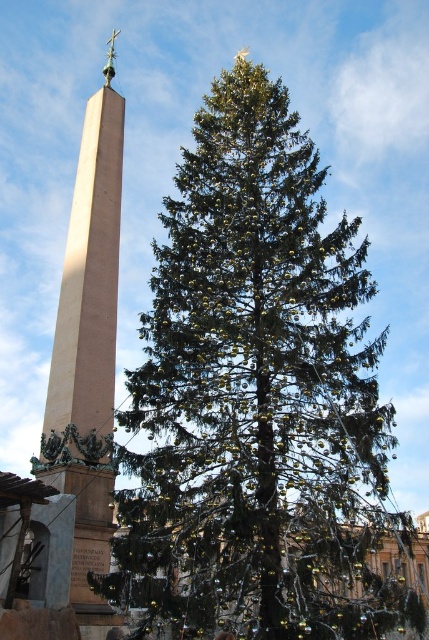
Question: Which of the following is the closest to the observer?

Choices:
 (A) (85, 124)
 (B) (183, 196)

Answer: (B)

Question: Is green textured pine tree at center in front of smooth beige obelisk at left?

Choices:
 (A) no
 (B) yes

Answer: (B)

Question: Which of the following is the farthest from the observer?

Choices:
 (A) smooth beige obelisk at left
 (B) green textured pine tree at center

Answer: (A)

Question: Can you confirm if green textured pine tree at center is positioned above smooth beige obelisk at left?

Choices:
 (A) yes
 (B) no

Answer: (B)

Question: Which of the following is the farthest from the observer?

Choices:
 (A) (253, 124)
 (B) (71, 227)

Answer: (B)

Question: Is green textured pine tree at center to the right of smooth beige obelisk at left from the viewer's perspective?

Choices:
 (A) yes
 (B) no

Answer: (A)